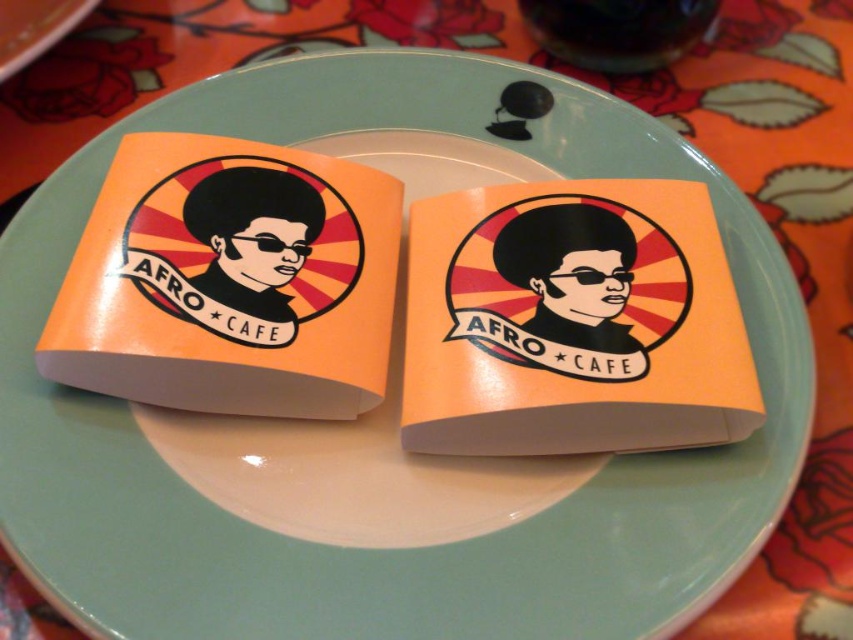
Does orange glossy sticker at center have a larger size compared to orange paper napkin at center?

Indeed, orange glossy sticker at center has a larger size compared to orange paper napkin at center.

Who is shorter, orange glossy sticker at center or orange paper napkin at center?

With less height is orange paper napkin at center.

Between point (251, 198) and point (38, 28), which one is positioned behind?

Point (251, 198)

Identify the location of orange glossy sticker at center. (230, 280).

Is orange matte sticker at center smaller than orange paper napkin at center?

No, orange matte sticker at center is not smaller than orange paper napkin at center.

From the picture: Can you confirm if orange matte sticker at center is positioned to the left of orange paper napkin at center?

In fact, orange matte sticker at center is to the right of orange paper napkin at center.

Between point (485, 355) and point (12, 36), which one is positioned behind?

The point (12, 36) is more distant.

At what (x,y) coordinates should I click in order to perform the action: click on orange matte sticker at center. Please return your answer as a coordinate pair (x, y). The height and width of the screenshot is (640, 853). Looking at the image, I should click on (572, 317).

Which is more to the left, orange matte sticker at center or orange glossy sticker at center?

orange glossy sticker at center is more to the left.

Locate an element on the screen. Image resolution: width=853 pixels, height=640 pixels. orange matte sticker at center is located at coordinates (572, 317).

Identify the location of orange matte sticker at center. (572, 317).